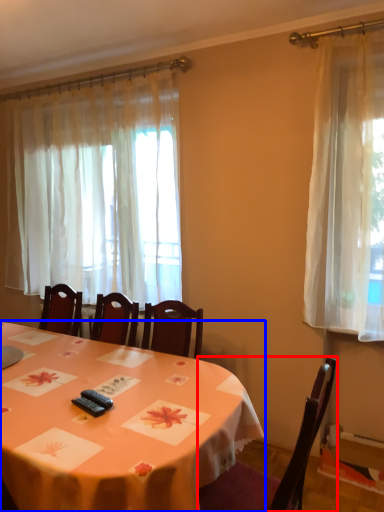
Question: Which of the following is the closest to the observer, chair (highlighted by a red box) or table (highlighted by a blue box)?

Choices:
 (A) chair
 (B) table

Answer: (B)